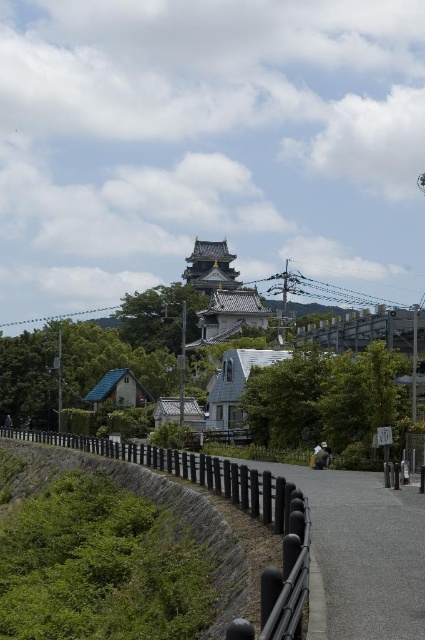
Question: Which point appears farthest from the camera in this image?

Choices:
 (A) (64, 458)
 (B) (351, 552)

Answer: (A)

Question: Where is black metal railing at lower center located in relation to stone wall at lower center in the image?

Choices:
 (A) right
 (B) left

Answer: (A)

Question: Does black metal railing at lower center appear under stone wall at lower center?

Choices:
 (A) yes
 (B) no

Answer: (B)

Question: From the image, what is the correct spatial relationship of black metal railing at lower center in relation to stone wall at lower center?

Choices:
 (A) below
 (B) above

Answer: (B)

Question: Among these points, which one is nearest to the camera?

Choices:
 (A) (210, 529)
 (B) (413, 560)

Answer: (B)